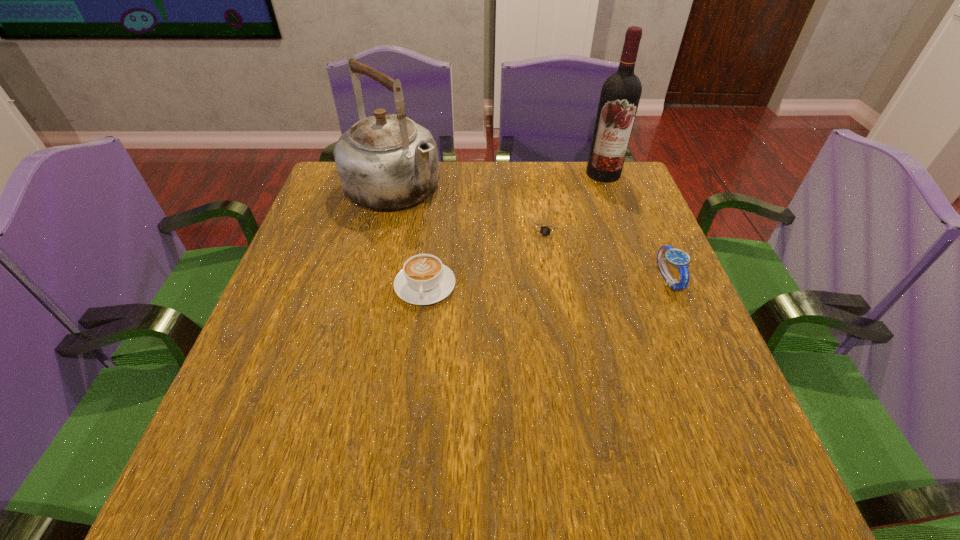
You are a GUI agent. You are given a task and a screenshot of the screen. Output one action in this format:
    pyautogui.click(x=<x>, y=<y>)
    Task: Click on the free point located on the label of the wine bottle
    This screenshot has width=960, height=540.
    Given the screenshot: What is the action you would take?
    pyautogui.click(x=593, y=191)

Identify the location of vacant space positioned 0.280m on the label of the wine bottle. Image resolution: width=960 pixels, height=540 pixels. (566, 238).

Find the location of `blank space located 0.370m on the face of the farther watch`. blank space located 0.370m on the face of the farther watch is located at coordinates (472, 357).

Where is `free space located 0.150m on the face of the farther watch`? The image size is (960, 540). free space located 0.150m on the face of the farther watch is located at coordinates (516, 284).

Where is `vacant space located on the face of the farther watch`? This screenshot has height=540, width=960. vacant space located on the face of the farther watch is located at coordinates (481, 342).

The image size is (960, 540). Find the location of `vacant area situated at the spout of the kettle`. vacant area situated at the spout of the kettle is located at coordinates (478, 256).

You are a GUI agent. You are given a task and a screenshot of the screen. Output one action in this format:
    pyautogui.click(x=<x>, y=<y>)
    Task: Click on the vacant region located at the spout of the kettle
    The height and width of the screenshot is (540, 960).
    Given the screenshot: What is the action you would take?
    pyautogui.click(x=533, y=298)

I want to click on free space located at the spout of the kettle, so click(487, 262).

Where is `wine bottle that is at the far edge`? The width and height of the screenshot is (960, 540). wine bottle that is at the far edge is located at coordinates (620, 95).

Identify the location of kettle present at the far edge. (387, 161).